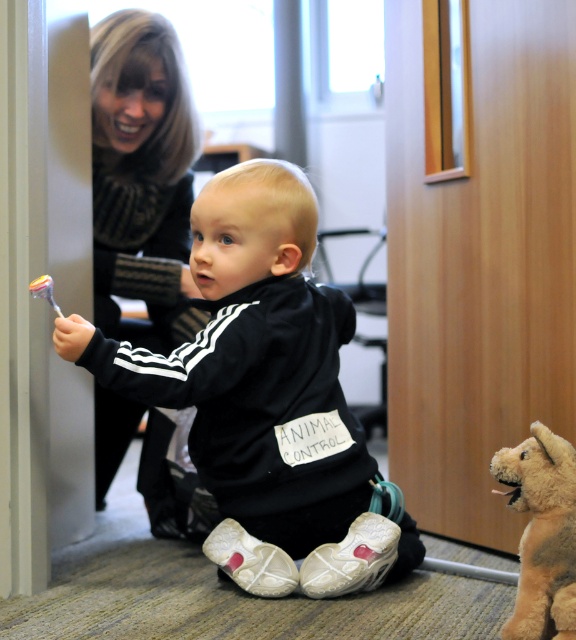
The image size is (576, 640). Describe the element at coordinates (266, 384) in the screenshot. I see `black matte jacket at center` at that location.

The height and width of the screenshot is (640, 576). I want to click on black matte jacket at center, so click(x=266, y=384).

From the picture: Can you confirm if black matte jacket at center is positioned above blonde hair at upper left?

Incorrect, black matte jacket at center is not positioned above blonde hair at upper left.

Is point (225, 284) behind point (154, 305)?

No, (225, 284) is closer to viewer.

The image size is (576, 640). Find the location of `black matte jacket at center`. black matte jacket at center is located at coordinates (266, 384).

Does point (101, 275) come in front of point (528, 449)?

No, (101, 275) is behind (528, 449).

Between blonde hair at upper left and fuzzy beige stuffed animal at lower right, which one has more height?

With more height is blonde hair at upper left.

Who is more distant from viewer, (x=132, y=236) or (x=563, y=547)?

The point (x=132, y=236) is more distant.

Locate an element on the screen. The height and width of the screenshot is (640, 576). blonde hair at upper left is located at coordinates (142, 179).